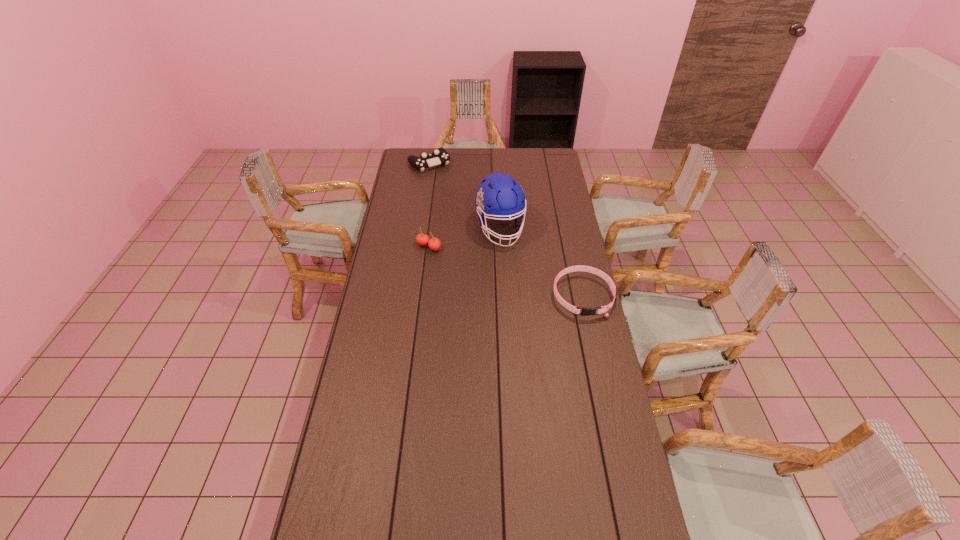
You are a GUI agent. You are given a task and a screenshot of the screen. Output one action in this format:
    pyautogui.click(x=<x>, y=<y>)
    Task: Click on the blank space located 0.380m on the surface of the control
    The image size is (960, 540).
    Given the screenshot: What is the action you would take?
    pyautogui.click(x=468, y=211)

What are the coordinates of `vacant point located 0.340m on the surface of the control` in the screenshot? It's located at (465, 206).

Identify the location of free space located on the face guard of the football helmet. (533, 313).

The height and width of the screenshot is (540, 960). I want to click on vacant space positioned on the face guard of the football helmet, so click(x=531, y=307).

This screenshot has width=960, height=540. What are the coordinates of `vacant area situated 0.170m on the face guard of the football helmet` in the screenshot? It's located at (517, 276).

Locate an element on the screen. object situated at the far edge is located at coordinates (440, 156).

Where is `cherry that is at the left edge`? cherry that is at the left edge is located at coordinates [434, 244].

Where is `control that is at the left edge`? The width and height of the screenshot is (960, 540). control that is at the left edge is located at coordinates (440, 156).

Find the location of `object that is at the right edge`. object that is at the right edge is located at coordinates (585, 311).

This screenshot has width=960, height=540. I want to click on object situated at the far left corner, so click(x=440, y=156).